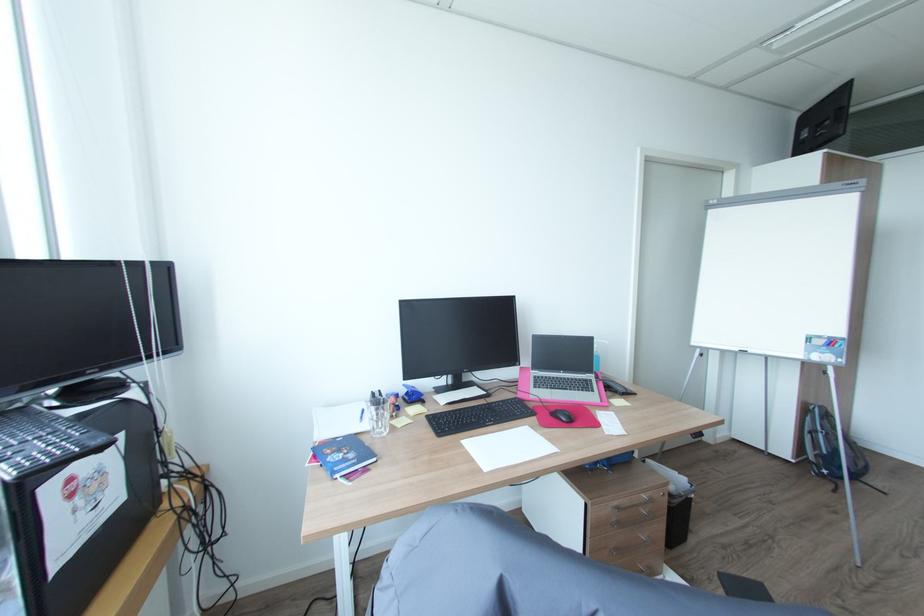
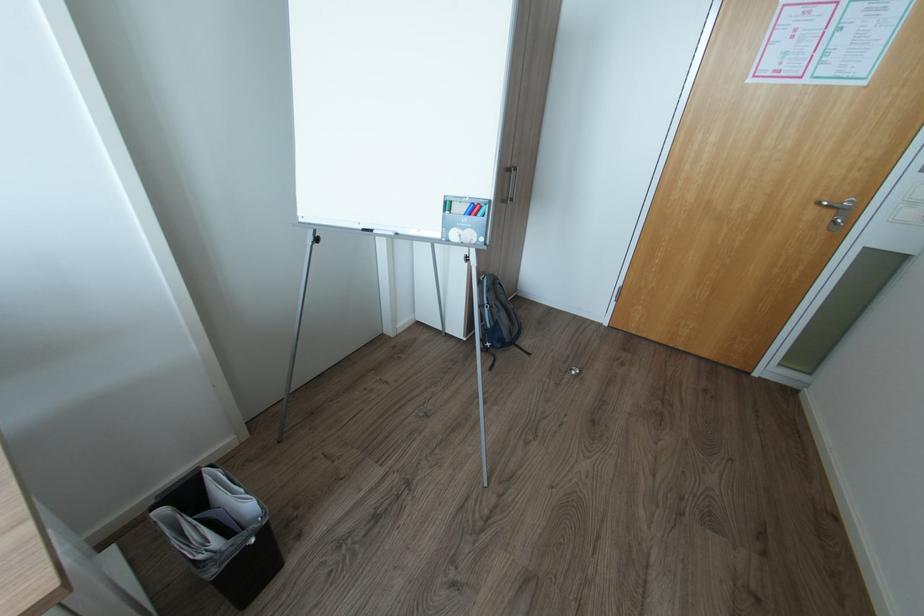
Locate, in the second image, the point that corresponds to [831,471] in the first image.

(492, 344)